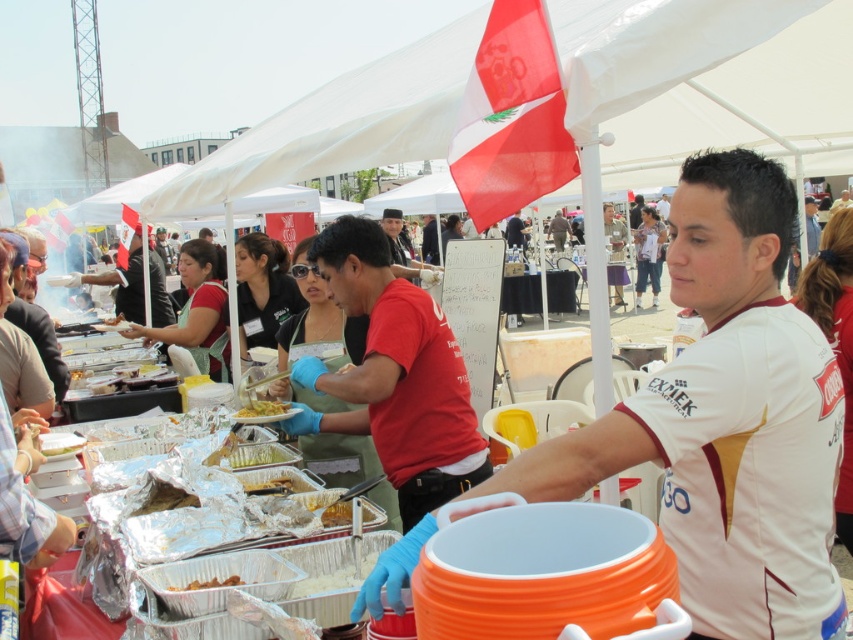
You are standing at the food distribution event and see the point at coordinates [270,484]. What is located at that point?

The point at coordinates [270,484] is on golden brown rice at center.

You are organizing a food distribution event and need to ensure that all attendees receive equal portions. You have two dishes at the center of the serving area, the golden brown rice at center and the brown matte food at center. Which dish should you prioritize to ensure that there are enough portions for everyone?

The golden brown rice at center is larger in size than the brown matte food at center, so you should prioritize distributing the golden brown rice at center first to ensure there are enough portions for everyone.